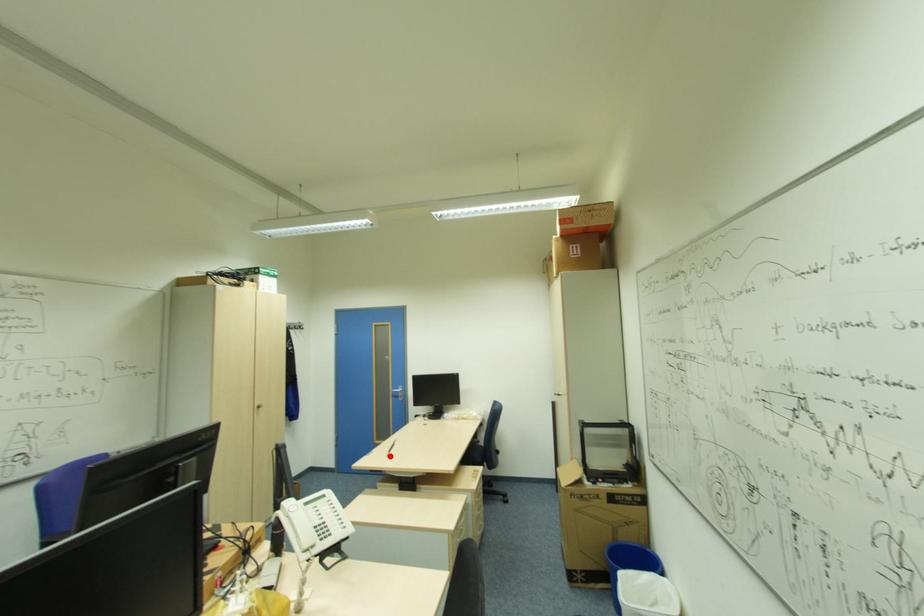
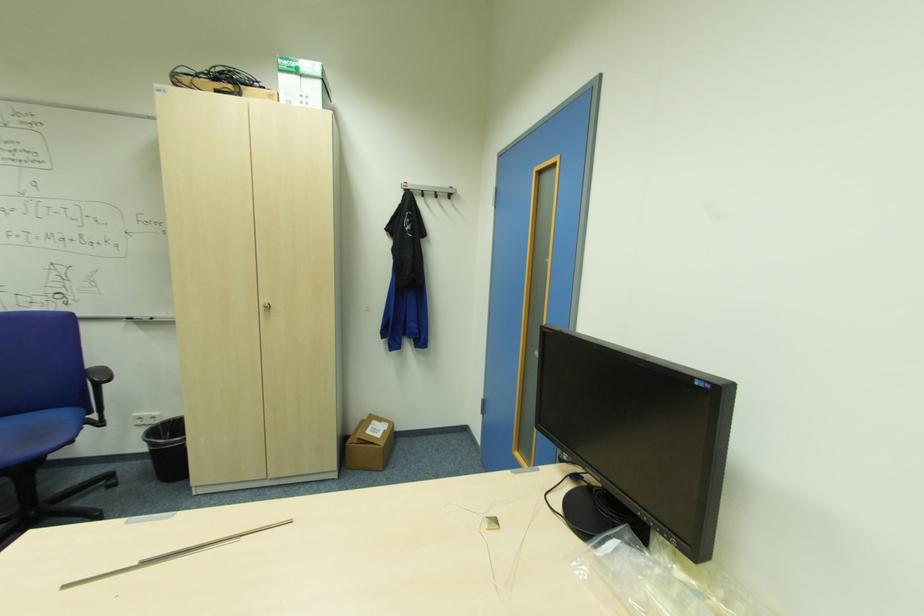
Question: I am providing you with two images of the same scene from different viewpoints. In image1, a red point is highlighted. Considering the same 3D point in image2, which of the following is correct?

Choices:
 (A) It is closer
 (B) It is farther

Answer: (A)